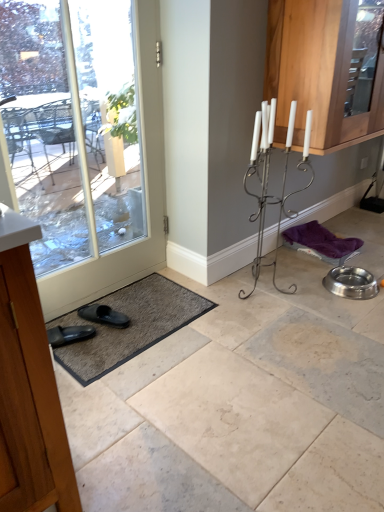
Image resolution: width=384 pixels, height=512 pixels. Identify the location of vacant area that is in front of gray textured bath mat at lower left. (174, 430).